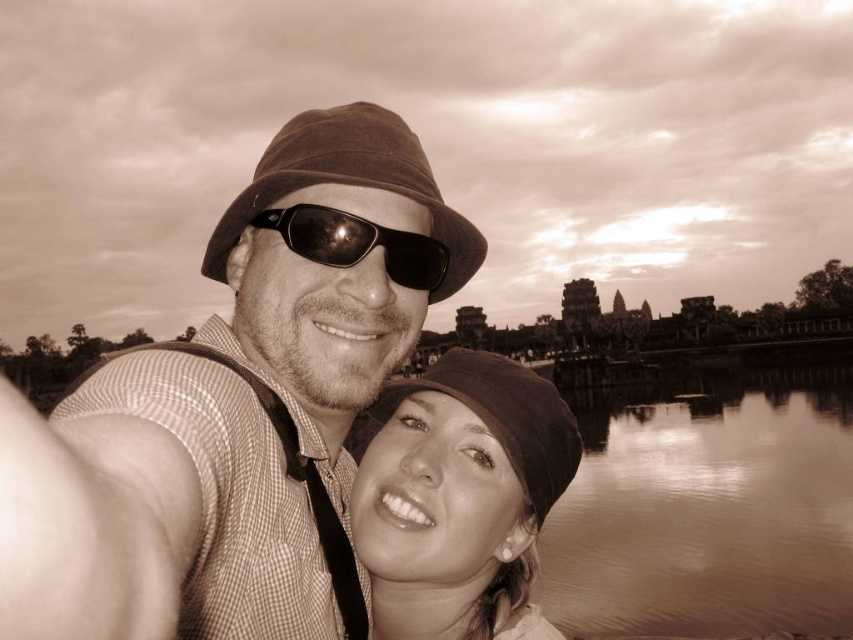
Question: Which point is farther to the camera?

Choices:
 (A) black reflective sunglasses at center
 (B) smooth water at lower right

Answer: (B)

Question: Estimate the real-world distances between objects in this image. Which object is closer to the black reflective sunglasses at center?

Choices:
 (A) smooth water at lower right
 (B) matte brown cap at lower center

Answer: (B)

Question: Does matte brown hat at center have a lesser width compared to matte brown cap at lower center?

Choices:
 (A) yes
 (B) no

Answer: (B)

Question: Does matte brown hat at center appear on the right side of black reflective sunglasses at center?

Choices:
 (A) yes
 (B) no

Answer: (B)

Question: Which object is farther from the camera taking this photo?

Choices:
 (A) matte brown cap at lower center
 (B) black reflective sunglasses at center
 (C) smooth water at lower right
 (D) matte brown hat at center

Answer: (C)

Question: Considering the relative positions of matte brown cap at lower center and black reflective sunglasses at center in the image provided, where is matte brown cap at lower center located with respect to black reflective sunglasses at center?

Choices:
 (A) left
 (B) right

Answer: (B)